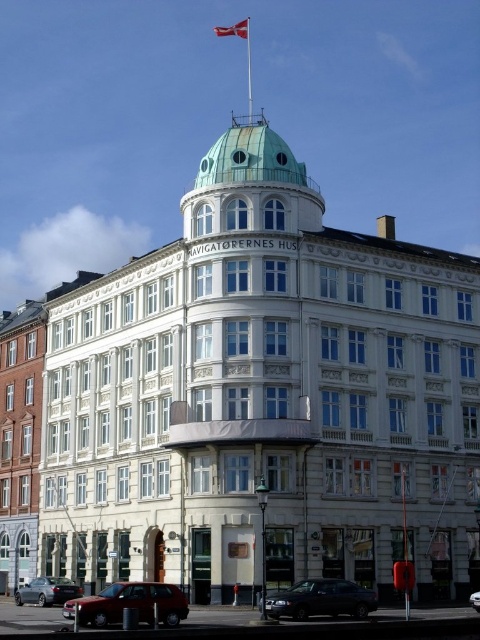
You are a photographer planning to capture the white glossy building at center and the metallic silver car at center in a single frame. Given that your camera has a fixed focal length, which object should you prioritize positioning closer to the camera to ensure both fit within the frame?

Since the white glossy building at center is wider than the metallic silver car at center, you should position the metallic silver car at center closer to the camera to ensure both fit within the frame.

You are standing in an urban area and see the white glossy building at left. If you want to take a photo of it from a distance of exactly 200 feet, should you move closer or farther away?

The white glossy building at left is currently 225.97 feet away from you, so you should move closer to reach the desired distance of 200 feet.